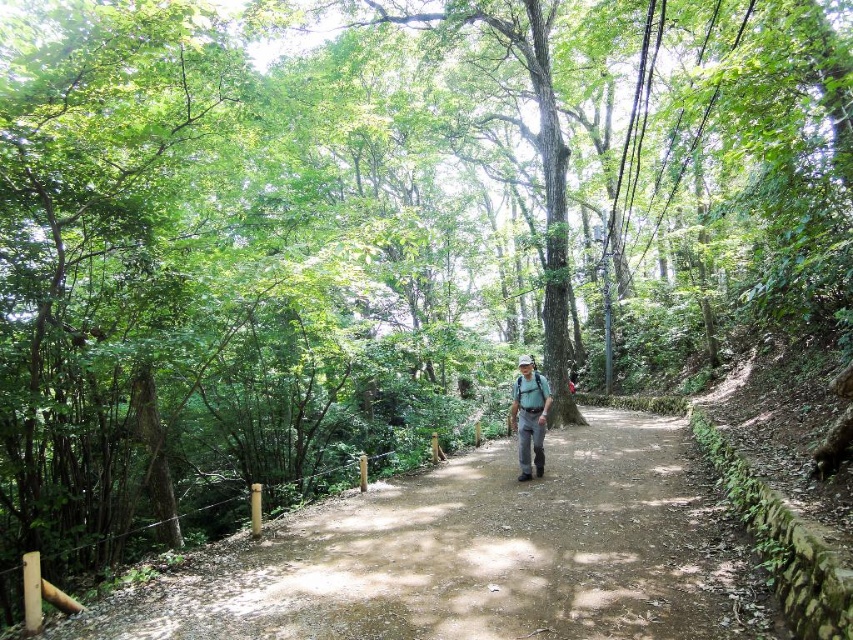
Question: Can you confirm if dirt path at center is wider than camouflage fabric backpack at center?

Choices:
 (A) no
 (B) yes

Answer: (B)

Question: Does dirt path at center have a smaller size compared to camouflage fabric backpack at center?

Choices:
 (A) no
 (B) yes

Answer: (A)

Question: Observing the image, what is the correct spatial positioning of dirt path at center in reference to camouflage fabric backpack at center?

Choices:
 (A) above
 (B) below

Answer: (B)